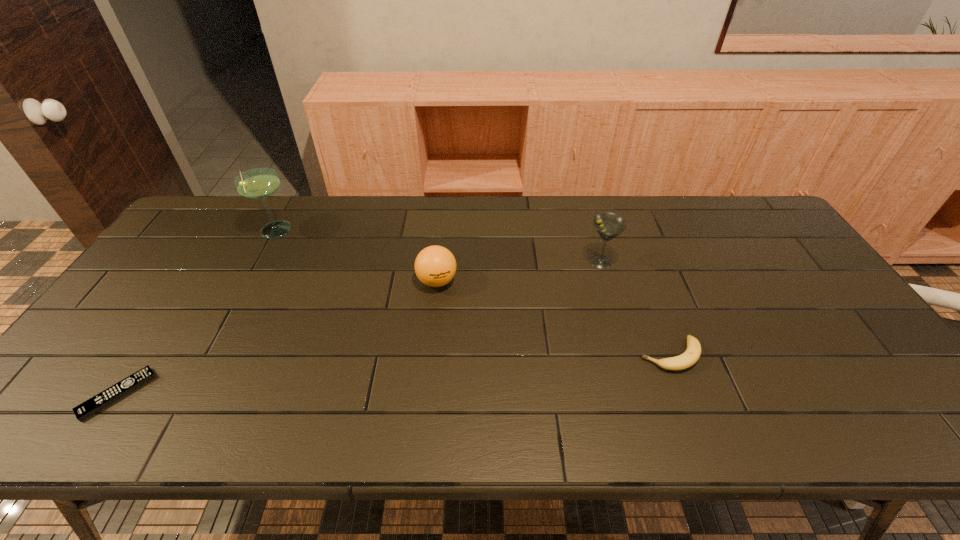
Locate an element on the screen. Image resolution: width=960 pixels, height=540 pixels. vacant space at the left edge of the desktop is located at coordinates [x=166, y=300].

The width and height of the screenshot is (960, 540). I want to click on free region at the right edge of the desktop, so click(x=865, y=359).

This screenshot has width=960, height=540. In the image, there is a desktop. Identify the location of free space at the far left corner. (187, 226).

Locate an element on the screen. The width and height of the screenshot is (960, 540). free area in between the ping-pong ball and the right martini is located at coordinates (518, 272).

You are a GUI agent. You are given a task and a screenshot of the screen. Output one action in this format:
    pyautogui.click(x=<x>, y=<y>)
    Task: Click on the vacant area between the third object from left to right and the remote control
    The image size is (960, 540).
    Given the screenshot: What is the action you would take?
    pyautogui.click(x=277, y=338)

At what (x,y) coordinates should I click in order to perform the action: click on vacant area that lies between the third object from left to right and the right martini. Please return your answer as a coordinate pair (x, y). This screenshot has width=960, height=540. Looking at the image, I should click on (518, 272).

Image resolution: width=960 pixels, height=540 pixels. I want to click on free space between the remote control and the fourth object from right to left, so click(196, 312).

Image resolution: width=960 pixels, height=540 pixels. I want to click on vacant region between the third tallest object and the fourth tallest object, so click(x=554, y=318).

Locate an element on the screen. This screenshot has height=540, width=960. free area in between the third object from right to left and the fourth object from right to left is located at coordinates (356, 256).

At what (x,y) coordinates should I click in order to perform the action: click on free spot between the leftmost object and the banana. Please return your answer as a coordinate pair (x, y). This screenshot has height=540, width=960. Looking at the image, I should click on (394, 375).